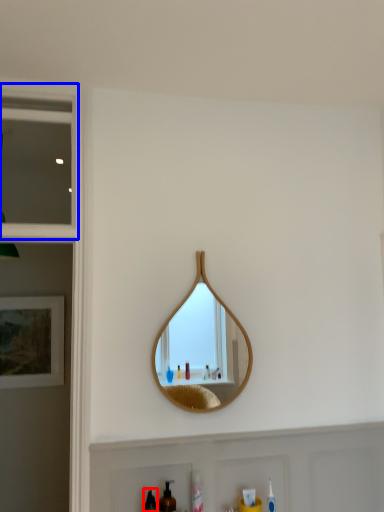
Question: Which object appears closest to the camera in this image, mouthwash (highlighted by a red box) or window (highlighted by a blue box)?

Choices:
 (A) mouthwash
 (B) window

Answer: (A)